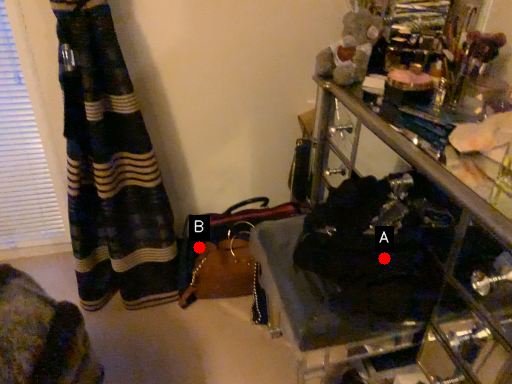
Question: Two points are circled on the image, labeled by A and B beside each circle. Among these points, which one is farthest from the camera?

Choices:
 (A) A is further
 (B) B is further

Answer: (B)